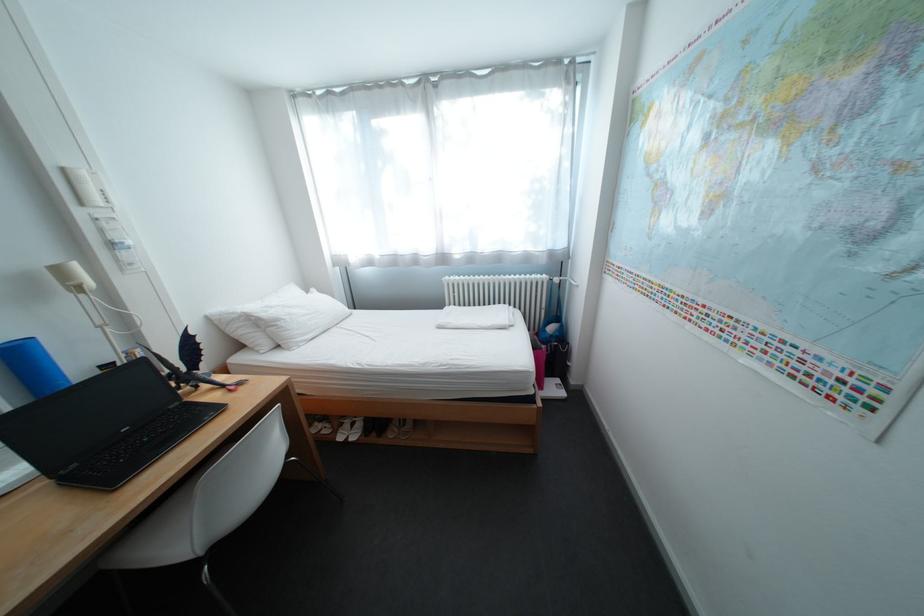
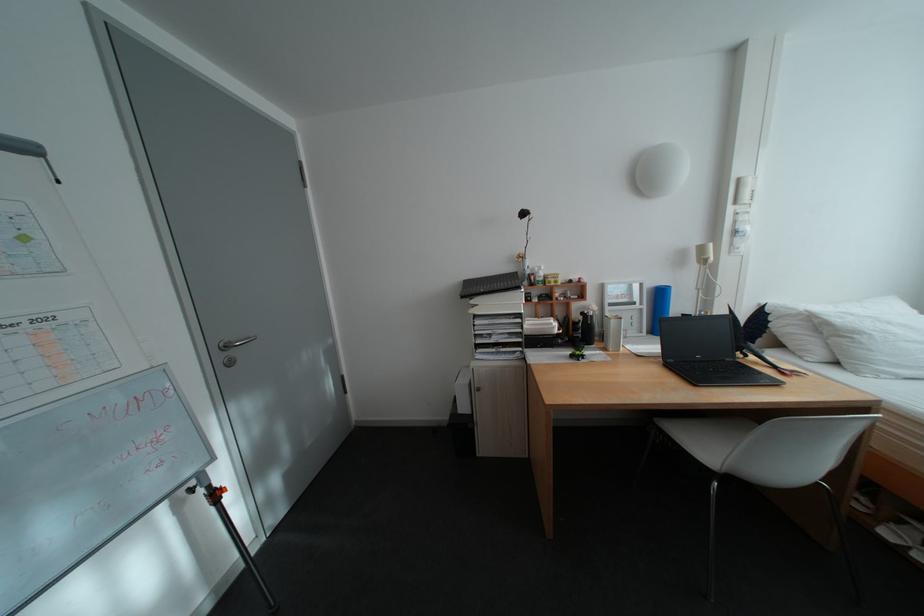
In the second image, find the point that corresponds to (x=127, y=363) in the first image.

(703, 315)